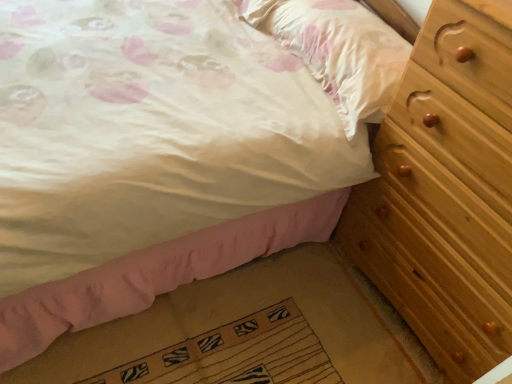
Locate an element on the screen. The width and height of the screenshot is (512, 384). light brown wooden chest of drawers at right is located at coordinates (445, 193).

Is light brown wooden chest of drawers at right far from textured beige mat at lower center?

No, light brown wooden chest of drawers at right is not far from textured beige mat at lower center.

Based on the photo, which is more to the left, light brown wooden chest of drawers at right or textured beige mat at lower center?

textured beige mat at lower center.

Which of these two, light brown wooden chest of drawers at right or textured beige mat at lower center, is thinner?

textured beige mat at lower center is thinner.

Measure the distance from light brown wooden chest of drawers at right to textured beige mat at lower center.

light brown wooden chest of drawers at right and textured beige mat at lower center are 59.07 centimeters apart from each other.

From a real-world perspective, relative to matte white pillow at upper right, is textured beige mat at lower center vertically above or below?

From a real-world perspective, textured beige mat at lower center is physically below matte white pillow at upper right.

Is textured beige mat at lower center looking in the opposite direction of matte white pillow at upper right?

That's not correct — textured beige mat at lower center is not looking away from matte white pillow at upper right.

Does point (274, 363) lie in front of point (297, 38)?

Yes, it is in front of point (297, 38).

Considering the relative positions of textured beige mat at lower center and matte white pillow at upper right in the image provided, is textured beige mat at lower center to the right of matte white pillow at upper right from the viewer's perspective?

In fact, textured beige mat at lower center is to the left of matte white pillow at upper right.

Looking at this image, which point is more forward, (227, 328) or (294, 225)?

Point (227, 328)

How many degrees apart are the facing directions of textured beige mat at lower center and wooden bed frame at lower right?

There is a 91.9-degree angle between the facing directions of textured beige mat at lower center and wooden bed frame at lower right.

How distant is textured beige mat at lower center from wooden bed frame at lower right?

The distance of textured beige mat at lower center from wooden bed frame at lower right is 11.46 inches.

Is textured beige mat at lower center far away from wooden bed frame at lower right?

No, there isn't a large distance between textured beige mat at lower center and wooden bed frame at lower right.

From a real-world perspective, between wooden bed frame at lower right and light brown wooden chest of drawers at right, who is vertically lower?

In real-world perspective, wooden bed frame at lower right is lower.

From the image's perspective, who appears lower, wooden bed frame at lower right or light brown wooden chest of drawers at right?

wooden bed frame at lower right, from the image's perspective.

Is wooden bed frame at lower right positioned with its back to light brown wooden chest of drawers at right?

No, wooden bed frame at lower right's orientation is not away from light brown wooden chest of drawers at right.

The width and height of the screenshot is (512, 384). What are the coordinates of `bed frame below the light brown wooden chest of drawers at right (from a real-world perspective)` in the screenshot? It's located at (156, 274).

Locate an element on the screen. bed frame lying below the light brown wooden chest of drawers at right (from the image's perspective) is located at coordinates (156, 274).

Would you say light brown wooden chest of drawers at right is outside wooden bed frame at lower right?

light brown wooden chest of drawers at right is positioned outside wooden bed frame at lower right.

Consider the image. Is light brown wooden chest of drawers at right to the left of wooden bed frame at lower right from the viewer's perspective?

No.

From a real-world perspective, which object stands above the other?

In real-world perspective, matte white pillow at upper right is above.

Are matte white pillow at upper right and light brown wooden chest of drawers at right located far from each other?

No, matte white pillow at upper right is not far away from light brown wooden chest of drawers at right.

Is matte white pillow at upper right in front of or behind light brown wooden chest of drawers at right in the image?

matte white pillow at upper right is positioned farther from the viewer than light brown wooden chest of drawers at right.

From the image's perspective, relative to matte white pillow at upper right, is light brown wooden chest of drawers at right above or below?

Clearly, from the image's perspective, light brown wooden chest of drawers at right is below matte white pillow at upper right.

Who is taller, light brown wooden chest of drawers at right or matte white pillow at upper right?

With more height is light brown wooden chest of drawers at right.

Relative to matte white pillow at upper right, is light brown wooden chest of drawers at right in front or behind?

light brown wooden chest of drawers at right is in front of matte white pillow at upper right.

Does light brown wooden chest of drawers at right contain matte white pillow at upper right?

No, matte white pillow at upper right is not surrounded by light brown wooden chest of drawers at right.

Find the location of a particular element. doormat below the light brown wooden chest of drawers at right (from the image's perspective) is located at coordinates (237, 354).

I want to click on pillow above the textured beige mat at lower center (from a real-world perspective), so click(338, 51).

Based on their spatial positions, is wooden bed frame at lower right or matte white pillow at upper right closer to light brown wooden chest of drawers at right?

Among the two, matte white pillow at upper right is located nearer to light brown wooden chest of drawers at right.

Estimate the real-world distances between objects in this image. Which object is further from textured beige mat at lower center, matte white pillow at upper right or wooden bed frame at lower right?

Among the two, matte white pillow at upper right is located further to textured beige mat at lower center.

From the image, which object appears to be farther from light brown wooden chest of drawers at right, matte white pillow at upper right or wooden bed frame at lower right?

Among the two, wooden bed frame at lower right is located further to light brown wooden chest of drawers at right.

Estimate the real-world distances between objects in this image. Which object is further from textured beige mat at lower center, wooden bed frame at lower right or light brown wooden chest of drawers at right?

light brown wooden chest of drawers at right.

From the image, which object appears to be nearer to textured beige mat at lower center, wooden bed frame at lower right or matte white pillow at upper right?

wooden bed frame at lower right lies closer to textured beige mat at lower center than the other object.

Considering their positions, is light brown wooden chest of drawers at right positioned closer to matte white pillow at upper right than textured beige mat at lower center?

The object closer to matte white pillow at upper right is light brown wooden chest of drawers at right.

Looking at the image, which one is located further to matte white pillow at upper right, wooden bed frame at lower right or textured beige mat at lower center?

textured beige mat at lower center is further to matte white pillow at upper right.

Which object lies further to the anchor point textured beige mat at lower center, matte white pillow at upper right or light brown wooden chest of drawers at right?

matte white pillow at upper right is further to textured beige mat at lower center.

Image resolution: width=512 pixels, height=384 pixels. I want to click on chest of drawers between matte white pillow at upper right and wooden bed frame at lower right from top to bottom, so click(x=445, y=193).

I want to click on bed frame between matte white pillow at upper right and textured beige mat at lower center from top to bottom, so click(156, 274).

The width and height of the screenshot is (512, 384). Find the location of `doormat situated between wooden bed frame at lower right and light brown wooden chest of drawers at right from left to right`. doormat situated between wooden bed frame at lower right and light brown wooden chest of drawers at right from left to right is located at coordinates (237, 354).

Where is `the chest of drawers that lies between matte white pillow at upper right and textured beige mat at lower center from top to bottom`? This screenshot has width=512, height=384. the chest of drawers that lies between matte white pillow at upper right and textured beige mat at lower center from top to bottom is located at coordinates (445, 193).